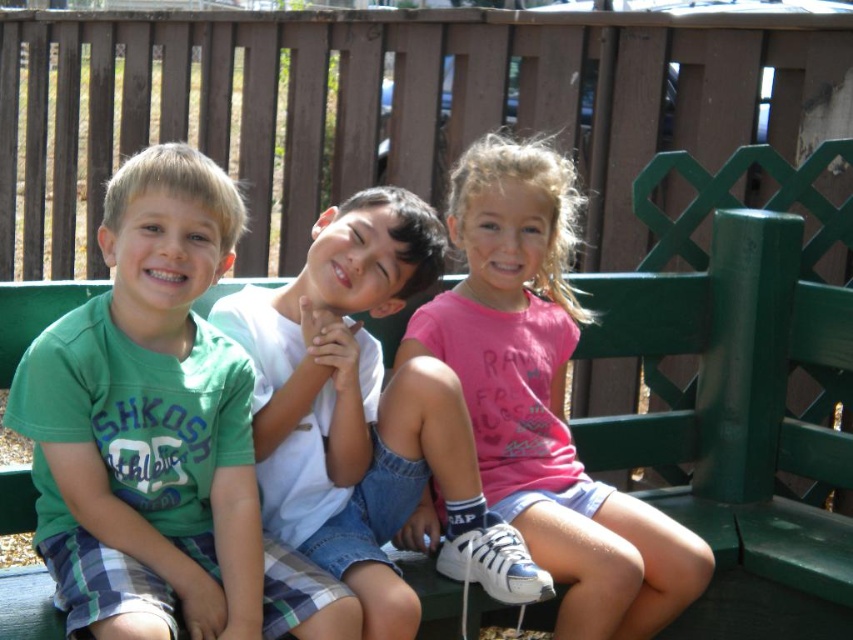
You are a photographer standing 2 meters away from the camera position. You want to take a photo of the green cotton shirt at left. Can you reach it with your camera lens without moving closer?

The green cotton shirt at left is 1.86 meters from the camera. Since you are standing 2 meters away from the camera position, you are effectively 3.86 meters away from the shirt. Most standard camera lenses can focus at that distance, so yes, you can capture the green cotton shirt at left without moving closer.

You are standing in front of the green wood bench at center and the pink cotton shirt at center. Which object is closer to you?

The green wood bench at center is closer to you than the pink cotton shirt at center.

You are standing in front of the green wooden bench where three children are sitting. You notice two points marked on the bench. The first point is at coordinates point(122, 563) and the second is at point(601, 564). Which of these two points is closer to you?

Point(122, 563) is closer to the viewer than point(601, 564).